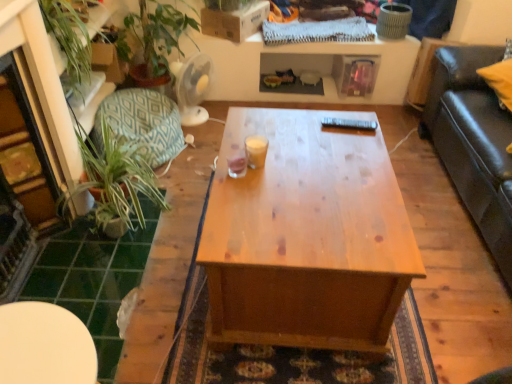
The width and height of the screenshot is (512, 384). What are the coordinates of `free space to the back side of translucent glass cup at center, the 2th coffee cup in the left-to-right sequence` in the screenshot? It's located at coord(255,137).